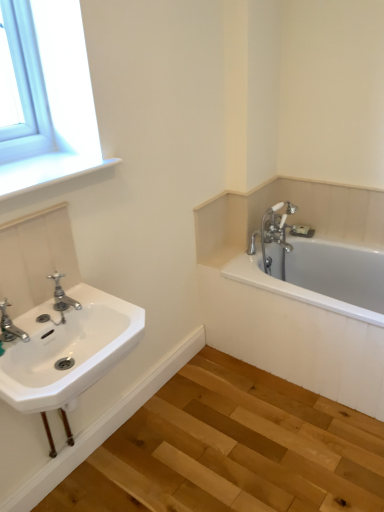
Find the location of a particular element. The height and width of the screenshot is (512, 384). vacant point to the right of polished chrome faucet at left, the 2th tap viewed from the front is located at coordinates (104, 308).